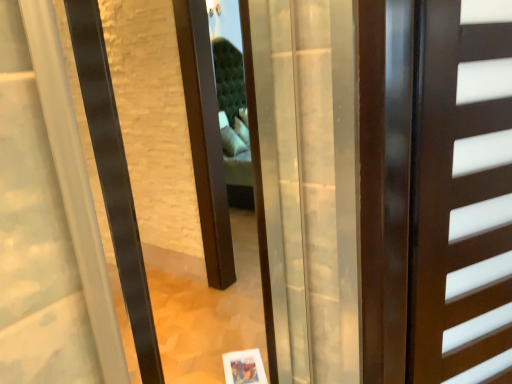
Find the location of a particular element. This screenshot has height=384, width=512. brown matte door at right is located at coordinates (462, 193).

Looking at this image, what is the approximate height of brown matte door at right?

brown matte door at right is 1.13 meters tall.

What do you see at coordinates (462, 193) in the screenshot?
I see `brown matte door at right` at bounding box center [462, 193].

Identify the location of brown matte door at right. This screenshot has width=512, height=384. (462, 193).